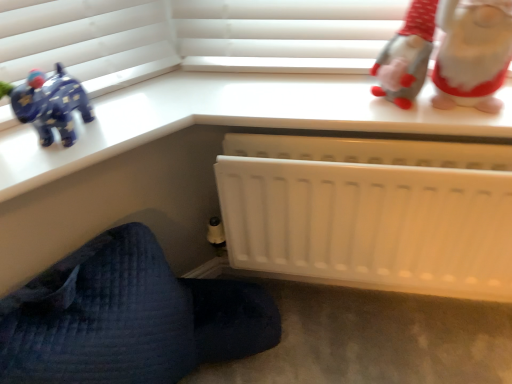
I want to click on white matte radiator at lower right, so click(x=128, y=318).

The width and height of the screenshot is (512, 384). Describe the element at coordinates (371, 212) in the screenshot. I see `white plastic radiator at lower center` at that location.

I want to click on white matte radiator at lower right, so click(x=128, y=318).

Is white matte radiator at lower right located outside white plush gnome at upper right?

Yes, white matte radiator at lower right is outside of white plush gnome at upper right.

Does white matte radiator at lower right touch white plush gnome at upper right?

white matte radiator at lower right is not next to white plush gnome at upper right, and they're not touching.

Can you confirm if white matte radiator at lower right is wider than white plush gnome at upper right?

Yes.

The height and width of the screenshot is (384, 512). What are the coordinates of `furniture below the white plush gnome at upper right (from a real-world perspective)` in the screenshot? It's located at (128, 318).

From the picture: Would you say white plush gnome at upper right contains white matte radiator at lower right?

No, white matte radiator at lower right is not inside white plush gnome at upper right.

How much distance is there between white plush gnome at upper right and white matte radiator at lower right?

white plush gnome at upper right is 30.21 inches from white matte radiator at lower right.

Does white plush gnome at upper right have a lesser width compared to white matte radiator at lower right?

Indeed, white plush gnome at upper right has a lesser width compared to white matte radiator at lower right.

From the image's perspective, is white plush gnome at upper right above white matte radiator at lower right?

Indeed, from the image's perspective, white plush gnome at upper right is shown above white matte radiator at lower right.

Is white plush gnome at upper right aimed at white plastic radiator at lower center?

No, white plush gnome at upper right is not aimed at white plastic radiator at lower center.

Does point (444, 65) lie in front of point (259, 141)?

Yes, it is in front of point (259, 141).

From a real-world perspective, between white plush gnome at upper right and white plastic radiator at lower center, who is vertically lower?

From a 3D spatial view, white plastic radiator at lower center is below.

Which is behind, white plush gnome at upper right or white plastic radiator at lower center?

white plastic radiator at lower center is more distant.

Based on the photo, considering their positions, is white plastic radiator at lower center located in front of or behind white plush gnome at upper right?

white plastic radiator at lower center is positioned farther from the viewer than white plush gnome at upper right.

Is white plastic radiator at lower center not near white plush gnome at upper right?

Actually, white plastic radiator at lower center and white plush gnome at upper right are a little close together.

Which of these two, white plastic radiator at lower center or white plush gnome at upper right, stands taller?

white plastic radiator at lower center is taller.

From a real-world perspective, is white plastic radiator at lower center on white plush gnome at upper right?

No, from a real-world perspective, white plastic radiator at lower center is not over white plush gnome at upper right

In the image, is white matte radiator at lower right on the left side or the right side of white plastic radiator at lower center?

white matte radiator at lower right is to the left of white plastic radiator at lower center.

From the image's perspective, which object appears higher, white matte radiator at lower right or white plastic radiator at lower center?

white plastic radiator at lower center is shown above in the image.

Does white matte radiator at lower right turn towards white plastic radiator at lower center?

No, white matte radiator at lower right does not turn towards white plastic radiator at lower center.

Considering the positions of objects white plastic radiator at lower center and white matte radiator at lower right in the image provided, who is behind, white plastic radiator at lower center or white matte radiator at lower right?

white plastic radiator at lower center is behind.

From a real-world perspective, is white plastic radiator at lower center over white matte radiator at lower right?

Indeed, from a real-world perspective, white plastic radiator at lower center stands above white matte radiator at lower right.

Which of these two, white plastic radiator at lower center or white matte radiator at lower right, is thinner?

Thinner between the two is white plastic radiator at lower center.

The height and width of the screenshot is (384, 512). In order to click on furniture in front of the white plush gnome at upper right in this screenshot , I will do `click(128, 318)`.

Image resolution: width=512 pixels, height=384 pixels. In the image, there is a white plush gnome at upper right. What are the coordinates of `furniture below it (from a real-world perspective)` in the screenshot? It's located at (128, 318).

When comparing their distances from white matte radiator at lower right, does white plastic radiator at lower center or white plush gnome at upper right seem closer?

Among the two, white plastic radiator at lower center is located nearer to white matte radiator at lower right.

Which object lies nearer to the anchor point white plush gnome at upper right, white plastic radiator at lower center or white matte radiator at lower right?

Based on the image, white plastic radiator at lower center appears to be nearer to white plush gnome at upper right.

Based on their spatial positions, is white matte radiator at lower right or white plush gnome at upper right closer to white plastic radiator at lower center?

Based on the image, white plush gnome at upper right appears to be nearer to white plastic radiator at lower center.

When comparing their distances from white matte radiator at lower right, does white plush gnome at upper right or white plastic radiator at lower center seem further?

Among the two, white plush gnome at upper right is located further to white matte radiator at lower right.

In the scene shown: Looking at the image, which one is located further to white plastic radiator at lower center, white plush gnome at upper right or white matte radiator at lower right?

The object further to white plastic radiator at lower center is white matte radiator at lower right.

Looking at the image, which one is located closer to white plush gnome at upper right, white matte radiator at lower right or white plastic radiator at lower center?

Based on the image, white plastic radiator at lower center appears to be nearer to white plush gnome at upper right.

Where is `infant bed situated between white matte radiator at lower right and white plush gnome at upper right from left to right`? This screenshot has height=384, width=512. infant bed situated between white matte radiator at lower right and white plush gnome at upper right from left to right is located at coordinates (371, 212).